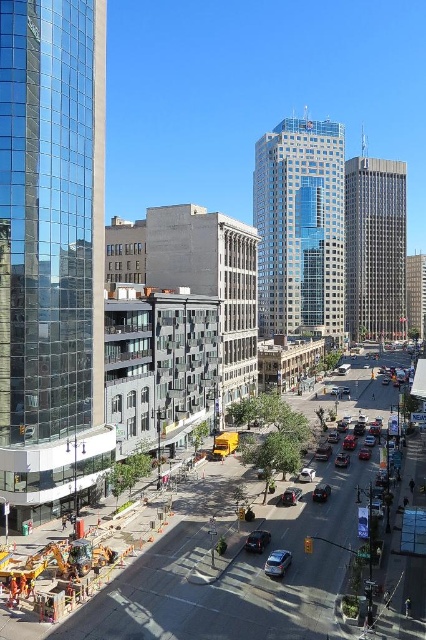
Can you confirm if concrete construction site at lower left is positioned to the left of shiny black sedan at center?

In fact, concrete construction site at lower left is to the right of shiny black sedan at center.

Between point (118, 618) and point (255, 552), which one is positioned behind?

Positioned behind is point (255, 552).

Between point (106, 634) and point (264, 540), which one is positioned behind?

The point (264, 540) is behind.

The height and width of the screenshot is (640, 426). I want to click on concrete construction site at lower left, so click(233, 572).

Can you confirm if concrete construction site at lower left is positioned below satin black sedan at center?

Correct, concrete construction site at lower left is located below satin black sedan at center.

Which is in front, point (419, 580) or point (325, 486)?

Point (419, 580)

Locate an element on the screen. concrete construction site at lower left is located at coordinates (233, 572).

Can you confirm if shiny black sedan at center is positioned to the left of satin black sedan at center?

Yes, shiny black sedan at center is to the left of satin black sedan at center.

In order to click on shiny black sedan at center in this screenshot , I will do pyautogui.click(x=256, y=540).

Who is more distant from viewer, (267, 538) or (311, 499)?

The point (311, 499) is behind.

What are the coordinates of `shiny black sedan at center` in the screenshot? It's located at (256, 540).